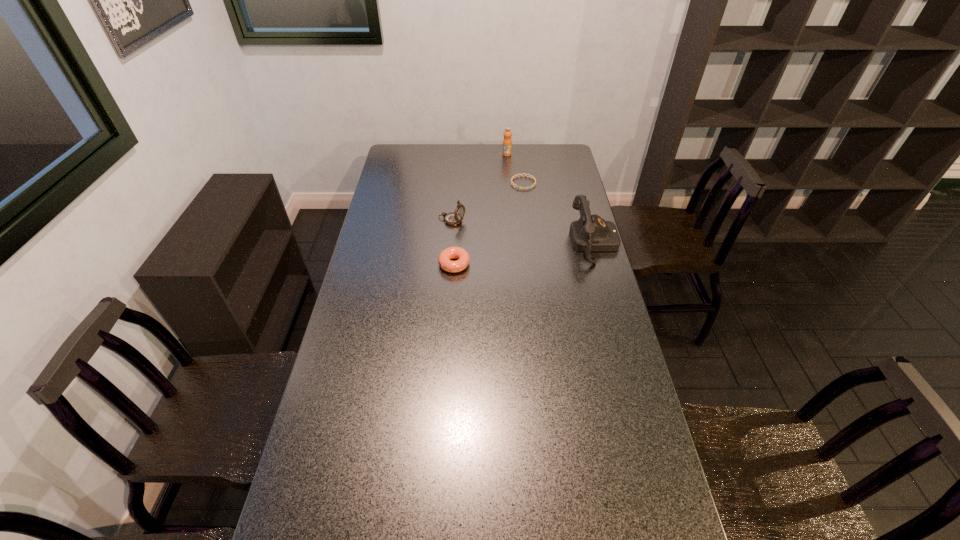
Locate an element on the screen. The width and height of the screenshot is (960, 540). vacant space on the desktop that is between the second shortest object and the telephone and is positioned on the front label of the second tallest object is located at coordinates (518, 254).

Find the location of a particular element. Image resolution: width=960 pixels, height=540 pixels. vacant space on the desktop that is between the fourth tallest object and the rightmost object and is positioned on the face of the third shortest object is located at coordinates click(x=538, y=252).

The image size is (960, 540). I want to click on vacant space on the desktop that is between the doughnut and the rightmost object and is positioned on the surface of the fourth nearest object showing star-shaped elements, so click(534, 252).